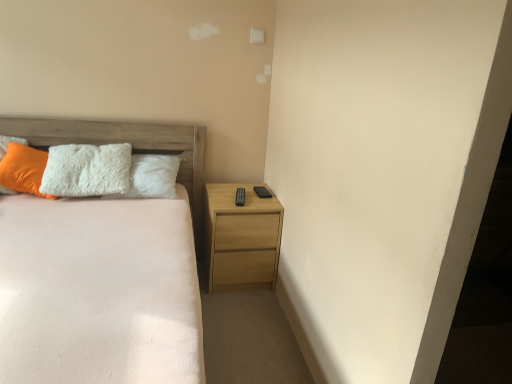
Question: Should I look upward or downward to see light wood/texture nightstand at right?

Choices:
 (A) up
 (B) down

Answer: (B)

Question: Is wooden headboard at upper left positioned with its back to white fluffy bed at center?

Choices:
 (A) yes
 (B) no

Answer: (A)

Question: Is wooden headboard at upper left aimed at white fluffy bed at center?

Choices:
 (A) yes
 (B) no

Answer: (A)

Question: Does wooden headboard at upper left have a lesser height compared to white fluffy bed at center?

Choices:
 (A) no
 (B) yes

Answer: (B)

Question: From a real-world perspective, is wooden headboard at upper left physically below white fluffy bed at center?

Choices:
 (A) yes
 (B) no

Answer: (B)

Question: Considering the relative sizes of wooden headboard at upper left and white fluffy bed at center in the image provided, is wooden headboard at upper left smaller than white fluffy bed at center?

Choices:
 (A) yes
 (B) no

Answer: (A)

Question: Does wooden headboard at upper left have a larger size compared to white fluffy bed at center?

Choices:
 (A) no
 (B) yes

Answer: (A)

Question: Is white fluffy bed at center not near orange fuzzy pillow at left?

Choices:
 (A) no
 (B) yes

Answer: (A)

Question: Does white fluffy bed at center appear on the left side of orange fuzzy pillow at left?

Choices:
 (A) no
 (B) yes

Answer: (A)

Question: Are white fluffy bed at center and orange fuzzy pillow at left beside each other?

Choices:
 (A) no
 (B) yes

Answer: (A)

Question: From a real-world perspective, is white fluffy bed at center physically below orange fuzzy pillow at left?

Choices:
 (A) no
 (B) yes

Answer: (B)

Question: Can you confirm if white fluffy bed at center is positioned to the right of orange fuzzy pillow at left?

Choices:
 (A) no
 (B) yes

Answer: (B)

Question: Considering the relative positions of white fluffy bed at center and orange fuzzy pillow at left in the image provided, is white fluffy bed at center in front of orange fuzzy pillow at left?

Choices:
 (A) yes
 (B) no

Answer: (A)

Question: Considering the relative sizes of wooden headboard at upper left and orange fuzzy pillow at left in the image provided, is wooden headboard at upper left wider than orange fuzzy pillow at left?

Choices:
 (A) no
 (B) yes

Answer: (B)